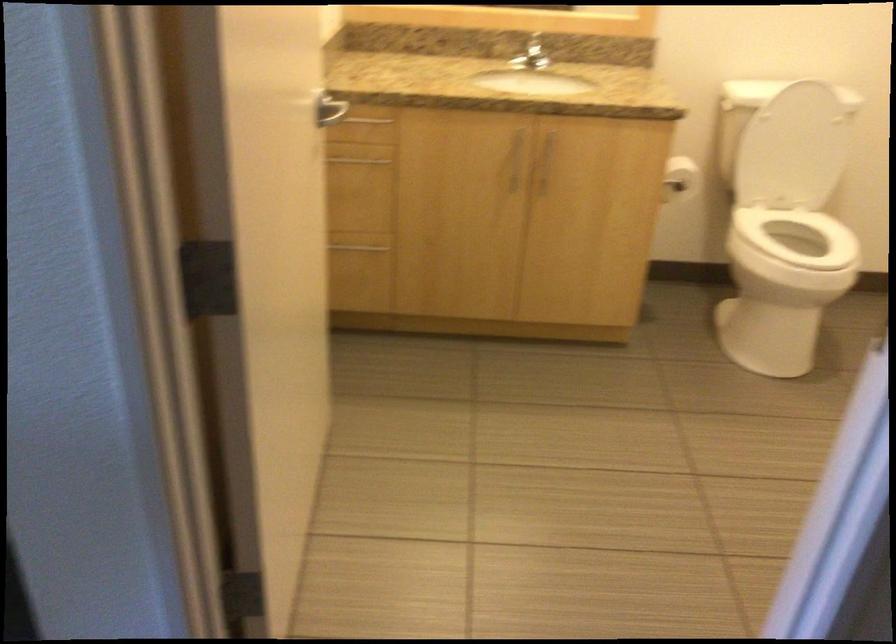
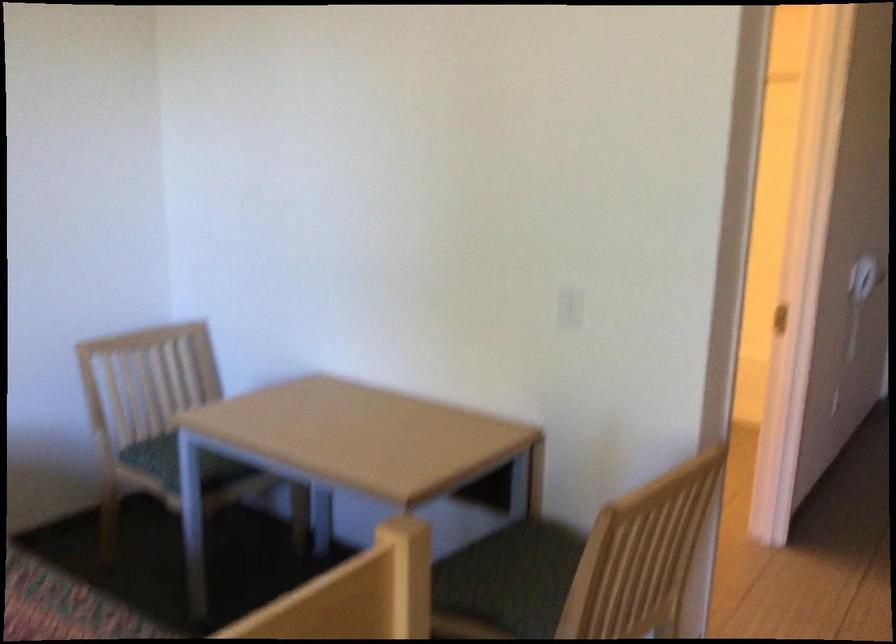
Question: I am providing you with two images of the same scene from different viewpoints. Which of the following objects are not visible in image2?

Choices:
 (A) heater wheel
 (B) chair sitting surface
 (C) white electrical outlet
 (D) toilet paper roll

Answer: (D)